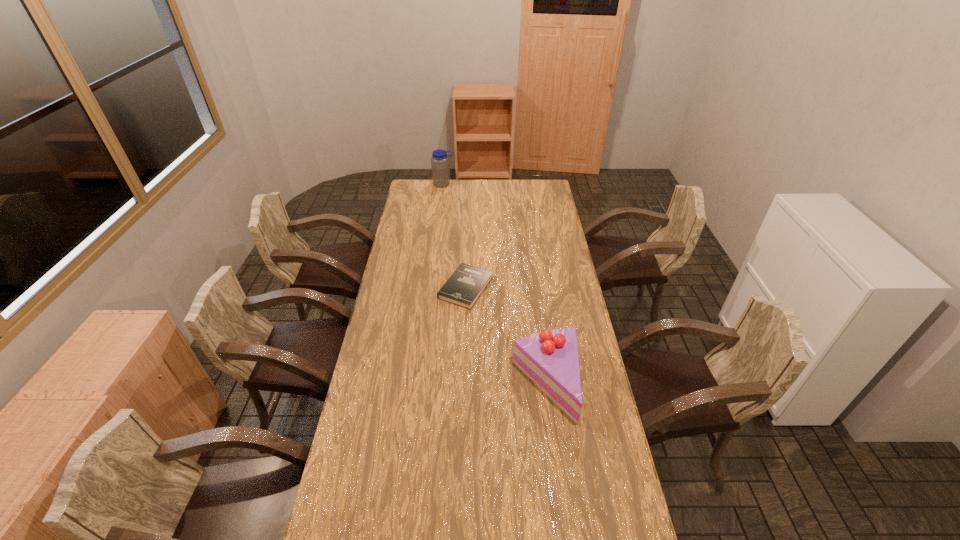
I want to click on water bottle, so click(440, 168).

Identify the location of the tallest object. Image resolution: width=960 pixels, height=540 pixels. (440, 168).

Locate an element on the screen. The height and width of the screenshot is (540, 960). the second shortest object is located at coordinates (550, 358).

Image resolution: width=960 pixels, height=540 pixels. In order to click on cake in this screenshot , I will do `click(550, 358)`.

I want to click on the second nearest object, so 464,287.

Where is `book`? The height and width of the screenshot is (540, 960). book is located at coordinates (464, 287).

Locate an element on the screen. The image size is (960, 540). vacant space situated 0.370m with a carrying loop on the side of the tallest object is located at coordinates (439, 224).

The width and height of the screenshot is (960, 540). In order to click on vacant area located on the left of the rightmost object in this screenshot , I will do `click(492, 383)`.

The image size is (960, 540). Identify the location of blank area located on the front of the book. (464, 358).

This screenshot has width=960, height=540. I want to click on object positioned at the far edge, so click(440, 168).